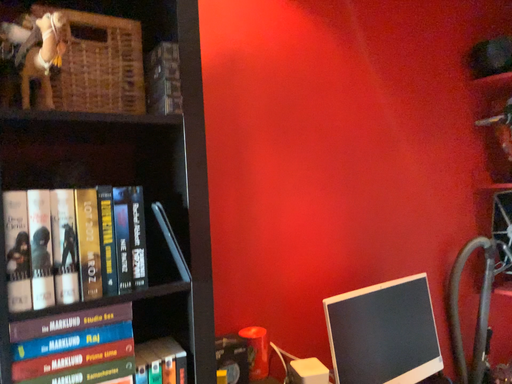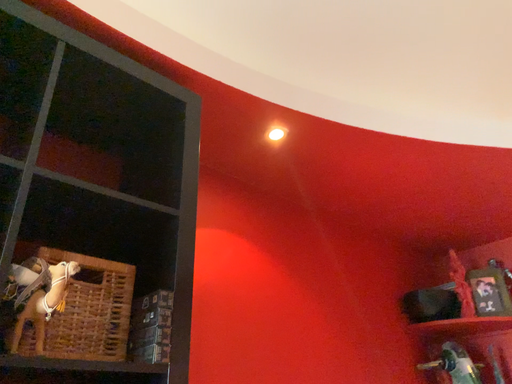
Question: Which way did the camera rotate in the video?

Choices:
 (A) rotated downward
 (B) rotated upward

Answer: (B)